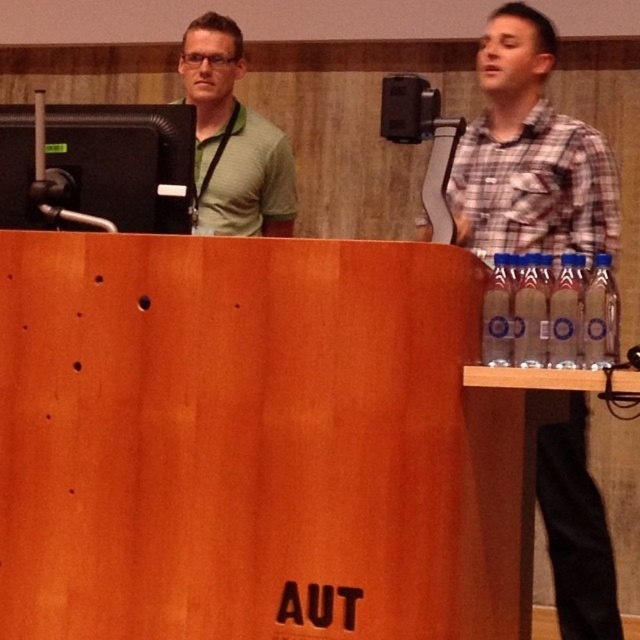
Between point (602, 236) and point (422, 116), which one is positioned in front?

Positioned in front is point (422, 116).

Can you confirm if clear plastic bottles at right is shorter than metallic speaker at upper center?

No.

Does point (512, 204) come farther from viewer compared to point (385, 88)?

Yes.

I want to click on clear plastic bottles at right, so click(529, 152).

Which is behind, point (273, 145) or point (400, 102)?

Positioned behind is point (273, 145).

You are a GUI agent. You are given a task and a screenshot of the screen. Output one action in this format:
    pyautogui.click(x=<x>, y=<y>)
    Task: Click on the green matte shirt at upper left
    
    Given the screenshot: What is the action you would take?
    pyautogui.click(x=234, y=138)

Describe the element at coordinates (529, 152) in the screenshot. The height and width of the screenshot is (640, 640). I see `clear plastic bottles at right` at that location.

Between point (564, 620) and point (259, 116), which one is positioned in front?

Positioned in front is point (564, 620).

I want to click on clear plastic bottles at right, so click(x=529, y=152).